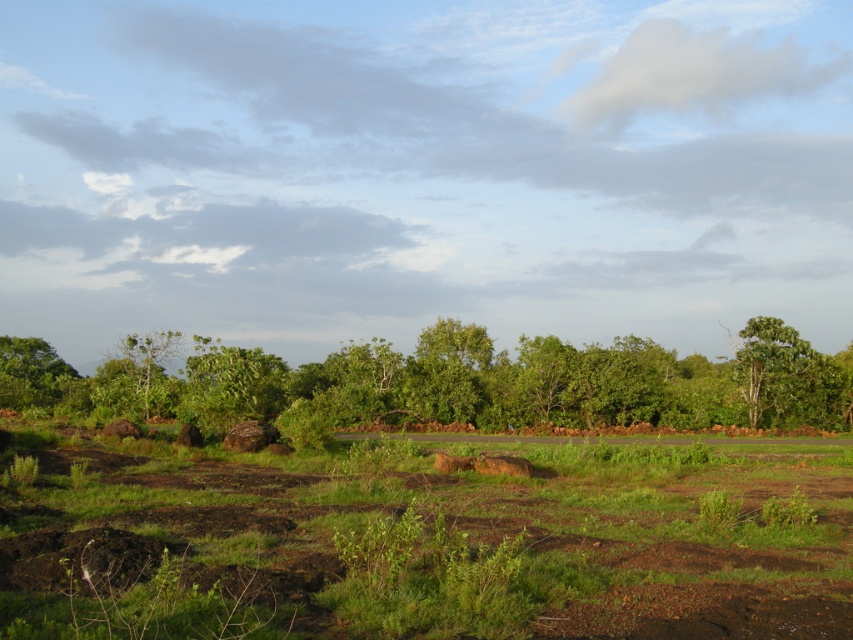
You are a hiker trying to decide which tree to rest under. You prefer a wider tree for shade. Based on the image, which tree should you choose between the green leafy tree at center and the green leafy tree at left?

The green leafy tree at center might be wider than green leafy tree at left, so you should choose the green leafy tree at center for shade.

You are standing in the middle of the grassland and want to walk towards the green leafy tree at center and the green leafy tree at left. Which tree will you reach first?

The green leafy tree at center is closer to the viewer than the green leafy tree at left, so you will reach the green leafy tree at center first.

You are standing in the serene natural landscape depicted in the image. You want to take a photo of the green leafy tree at center from a distance that allows you to capture its full canopy without any obstructions. Considering your camera has a maximum zoom range of 10 meters, can you achieve this without moving closer than your current position?

The green leafy tree at center is 24.08 meters away from the viewer. Since your camera can only zoom up to 10 meters, you cannot capture the tree at 24.08 meters with sufficient detail to show its full canopy without moving closer.